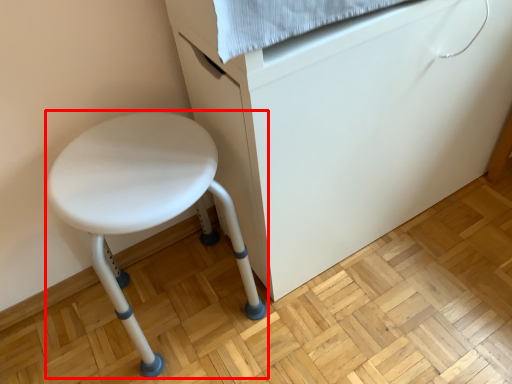
Question: From the image's perspective, where is stool (annotated by the red box) located relative to furniture?

Choices:
 (A) above
 (B) below

Answer: (B)